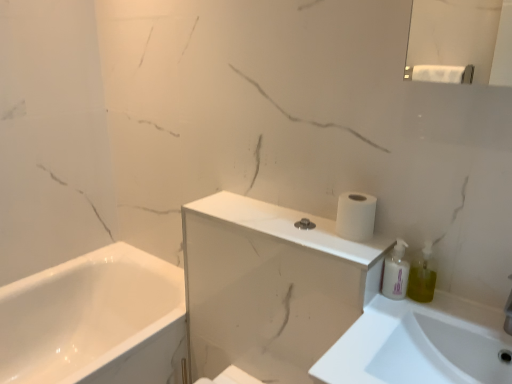
Question: Can you confirm if white glossy medicine cabinet at upper center is positioned to the right of white glossy sink at lower right?

Choices:
 (A) no
 (B) yes

Answer: (A)

Question: Can you confirm if white glossy medicine cabinet at upper center is shorter than white glossy sink at lower right?

Choices:
 (A) no
 (B) yes

Answer: (A)

Question: Can you confirm if white glossy medicine cabinet at upper center is positioned to the left of white glossy sink at lower right?

Choices:
 (A) no
 (B) yes

Answer: (B)

Question: Considering the relative sizes of white glossy medicine cabinet at upper center and white glossy sink at lower right in the image provided, is white glossy medicine cabinet at upper center bigger than white glossy sink at lower right?

Choices:
 (A) yes
 (B) no

Answer: (A)

Question: From a real-world perspective, is white glossy medicine cabinet at upper center beneath white glossy sink at lower right?

Choices:
 (A) no
 (B) yes

Answer: (B)

Question: From a real-world perspective, does white glossy medicine cabinet at upper center stand above white glossy sink at lower right?

Choices:
 (A) yes
 (B) no

Answer: (B)

Question: Is the position of white glossy sink at lower right less distant than that of green translucent soap dispenser at right?

Choices:
 (A) yes
 (B) no

Answer: (A)

Question: Is white glossy sink at lower right not within green translucent soap dispenser at right?

Choices:
 (A) yes
 (B) no

Answer: (A)

Question: Does white glossy sink at lower right have a lesser width compared to green translucent soap dispenser at right?

Choices:
 (A) yes
 (B) no

Answer: (B)

Question: Is white glossy sink at lower right looking in the opposite direction of green translucent soap dispenser at right?

Choices:
 (A) yes
 (B) no

Answer: (B)

Question: From a real-world perspective, is white glossy sink at lower right under green translucent soap dispenser at right?

Choices:
 (A) no
 (B) yes

Answer: (B)

Question: Considering the relative sizes of white glossy sink at lower right and green translucent soap dispenser at right in the image provided, is white glossy sink at lower right taller than green translucent soap dispenser at right?

Choices:
 (A) yes
 (B) no

Answer: (A)

Question: Are white glossy medicine cabinet at upper center and green translucent soap dispenser at right making contact?

Choices:
 (A) no
 (B) yes

Answer: (A)